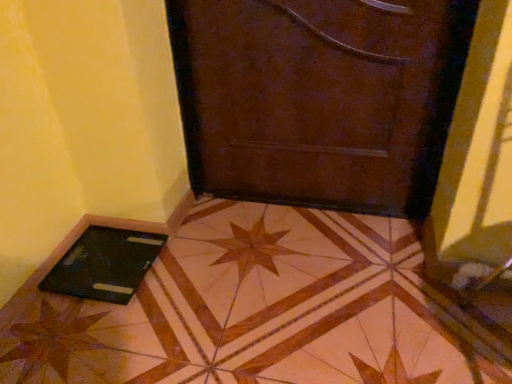
You are a GUI agent. You are given a task and a screenshot of the screen. Output one action in this format:
    pyautogui.click(x=<x>, y=<y>)
    Task: Click on the free spot in front of black matte tablet at lower left
    This screenshot has width=512, height=384.
    Given the screenshot: What is the action you would take?
    pyautogui.click(x=78, y=329)